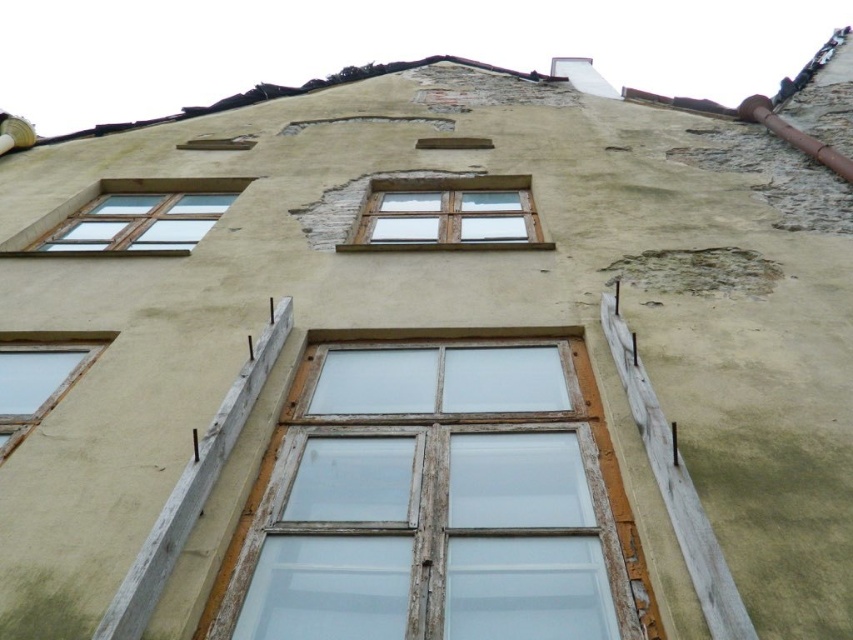
Question: From the image, what is the correct spatial relationship of clear glass window at upper left in relation to white wooden window at center?

Choices:
 (A) above
 (B) below

Answer: (B)

Question: Which point is closer to the camera?

Choices:
 (A) (68, 349)
 (B) (531, 365)

Answer: (B)

Question: Among these points, which one is nearest to the camera?

Choices:
 (A) (442, 220)
 (B) (486, 339)
 (C) (192, 246)
 (D) (22, 372)

Answer: (D)

Question: Is weathered wood window at center smaller than clear glass window at upper left?

Choices:
 (A) yes
 (B) no

Answer: (B)

Question: Is weathered wood window at center to the right of white wooden window at center from the viewer's perspective?

Choices:
 (A) yes
 (B) no

Answer: (B)

Question: Which of these objects is positioned closest to the white wooden window at center?

Choices:
 (A) weathered wood window at center
 (B) transparent glass window at lower left
 (C) clear glass window at upper left

Answer: (C)